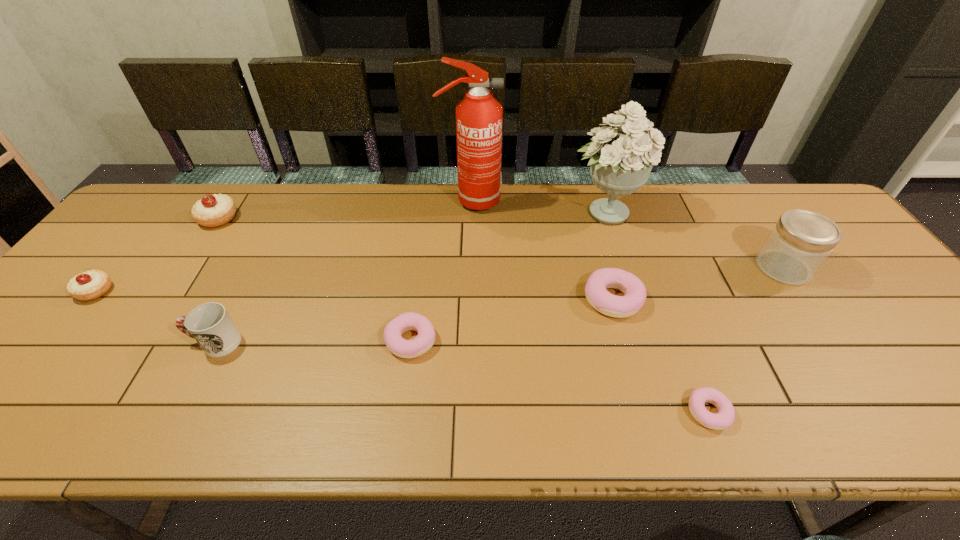
Locate an element on the screen. the nearer beige pastry is located at coordinates (90, 285).

Where is `the leftmost object`? the leftmost object is located at coordinates (90, 285).

Where is `the biggest pink pastry`? the biggest pink pastry is located at coordinates [x=599, y=298].

Locate an element on the screen. Image resolution: width=960 pixels, height=540 pixels. the second pink pastry from left to right is located at coordinates (599, 298).

Find the location of a particular element. The height and width of the screenshot is (540, 960). the second shortest object is located at coordinates (425, 339).

The image size is (960, 540). Identify the location of the second shortest pastry. (425, 339).

Identify the location of the smallest pink pastry. The image size is (960, 540). (724, 418).

Where is `the shortest object`? This screenshot has height=540, width=960. the shortest object is located at coordinates (724, 418).

Identify the location of vacant space situated 0.260m at the nozzle of the tallest object. The width and height of the screenshot is (960, 540). (582, 201).

You are a GUI agent. You are given a task and a screenshot of the screen. Output one action in this format:
    pyautogui.click(x=<x>, y=<y>)
    Task: Click on the free location located on the front of the bouquet
    
    Given the screenshot: What is the action you would take?
    pyautogui.click(x=631, y=293)